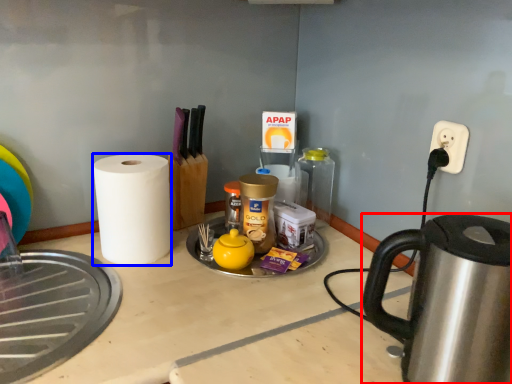
Question: Among these objects, which one is farthest to the camera, kettle (highlighted by a red box) or paper towel (highlighted by a blue box)?

Choices:
 (A) kettle
 (B) paper towel

Answer: (B)